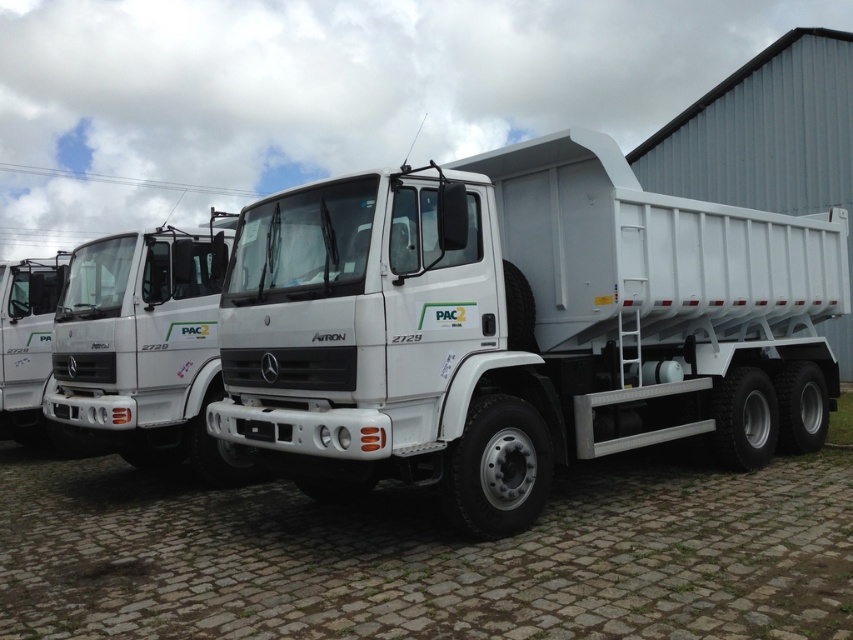
Can you confirm if white matte trailer truck at center is wider than white matte truck at center?

No, white matte trailer truck at center is not wider than white matte truck at center.

From the picture: Can you confirm if white matte trailer truck at center is smaller than white matte truck at center?

Correct, white matte trailer truck at center occupies less space than white matte truck at center.

Which is in front, point (488, 248) or point (157, 273)?

Point (488, 248) is in front.

Locate an element on the screen. Image resolution: width=853 pixels, height=640 pixels. white matte trailer truck at center is located at coordinates (519, 326).